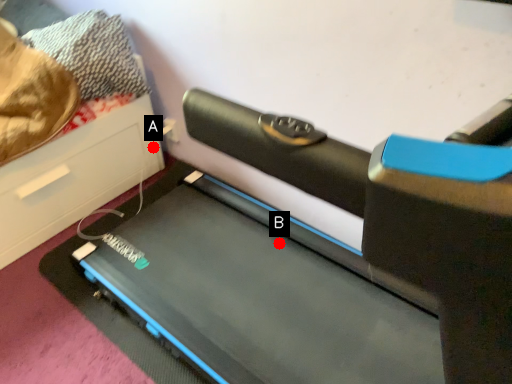
Question: Two points are circled on the image, labeled by A and B beside each circle. Which point appears farthest from the camera in this image?

Choices:
 (A) A is further
 (B) B is further

Answer: (A)